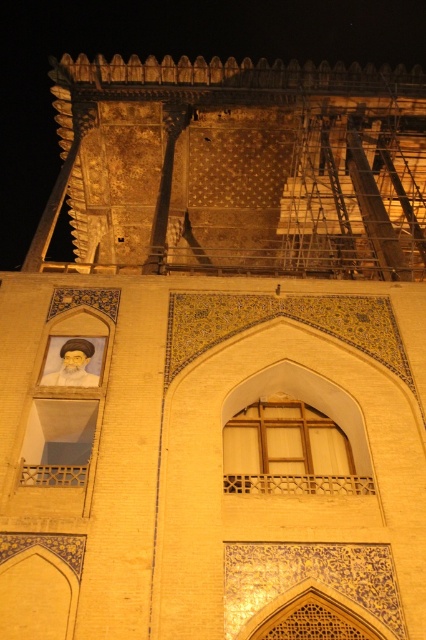
You are an architect inspecting the building at night. You notice the wooden at center and the white matte window at lower left. Which object is taller?

The white matte window at lower left is taller than the wooden at center.

You are an architect examining the building. You need to compare the size of the gold mosaic wall at upper center and the white matte window at lower left. Which one is wider?

The gold mosaic wall at upper center is wider than the white matte window at lower left.

You are standing in front of the historic building and notice two points marked on its facade. The first point is at coordinate point(397, 17) and the second is at point(322, 476). Which point is closer to you?

Point(397, 17) is closer to you because it is further to the viewer than point(322, 476).